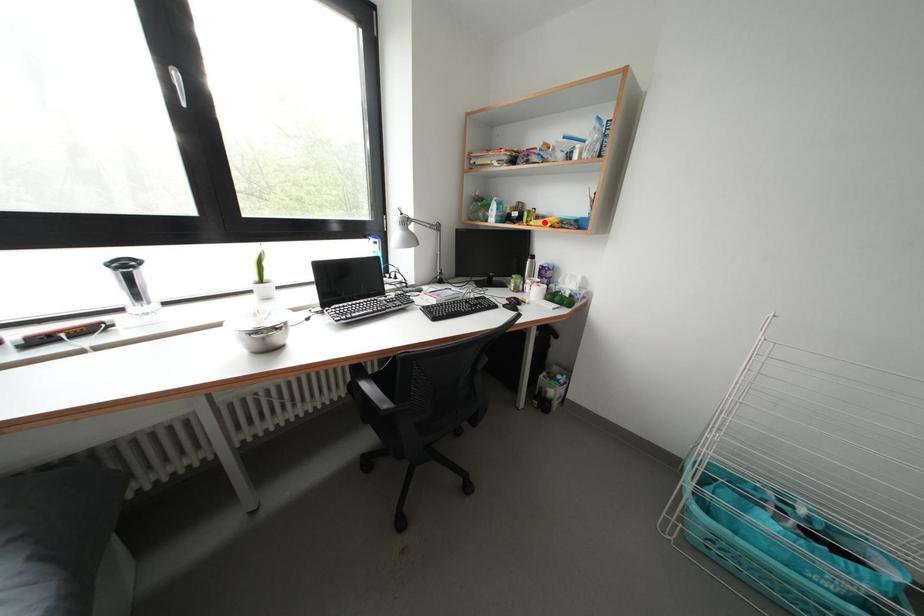
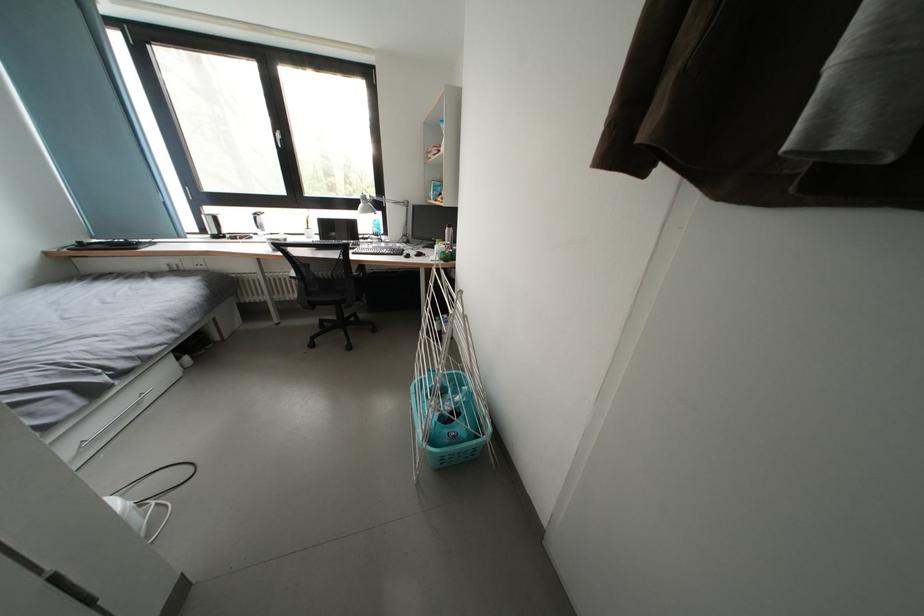
Question: I am providing you with two images of the same scene from different viewpoints. A red point is marked on the first image. Is the red point's position out of view in image 2?

Choices:
 (A) Yes
 (B) No

Answer: (A)